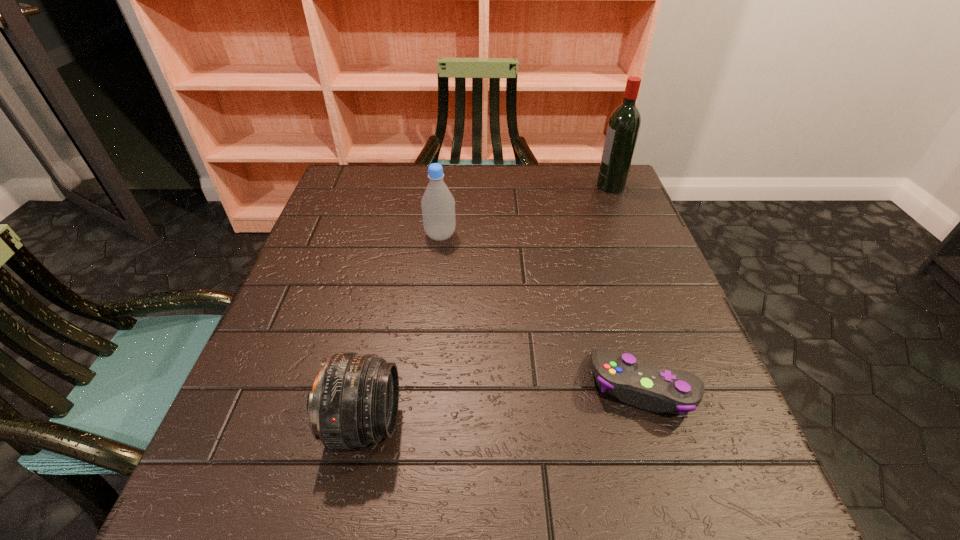
Where is `vacant space situated 0.270m at the front element of the third tallest object`? This screenshot has height=540, width=960. vacant space situated 0.270m at the front element of the third tallest object is located at coordinates 567,423.

The width and height of the screenshot is (960, 540). Find the location of `free location located 0.360m on the back of the control`. free location located 0.360m on the back of the control is located at coordinates (596, 233).

Image resolution: width=960 pixels, height=540 pixels. Find the location of `object present at the far edge`. object present at the far edge is located at coordinates (624, 124).

You are a GUI agent. You are given a task and a screenshot of the screen. Output one action in this format:
    pyautogui.click(x=<x>, y=<y>)
    Task: Click on the wine bottle that is positioned at the right edge
    The width and height of the screenshot is (960, 540).
    Given the screenshot: What is the action you would take?
    (624, 124)

Where is `control positioned at the right edge`? The height and width of the screenshot is (540, 960). control positioned at the right edge is located at coordinates (646, 386).

The height and width of the screenshot is (540, 960). Identify the location of object positioned at the far right corner. (624, 124).

The width and height of the screenshot is (960, 540). Identify the location of free space at the far edge. (561, 176).

In the image, there is a desktop. At what (x,y) coordinates should I click in order to perform the action: click on free region at the left edge. Please return your answer as a coordinate pair (x, y). The width and height of the screenshot is (960, 540). Looking at the image, I should click on (244, 395).

The width and height of the screenshot is (960, 540). I want to click on vacant area at the right edge of the desktop, so coord(635,295).

Identify the location of vacant area at the far left corner. The height and width of the screenshot is (540, 960). (330, 203).